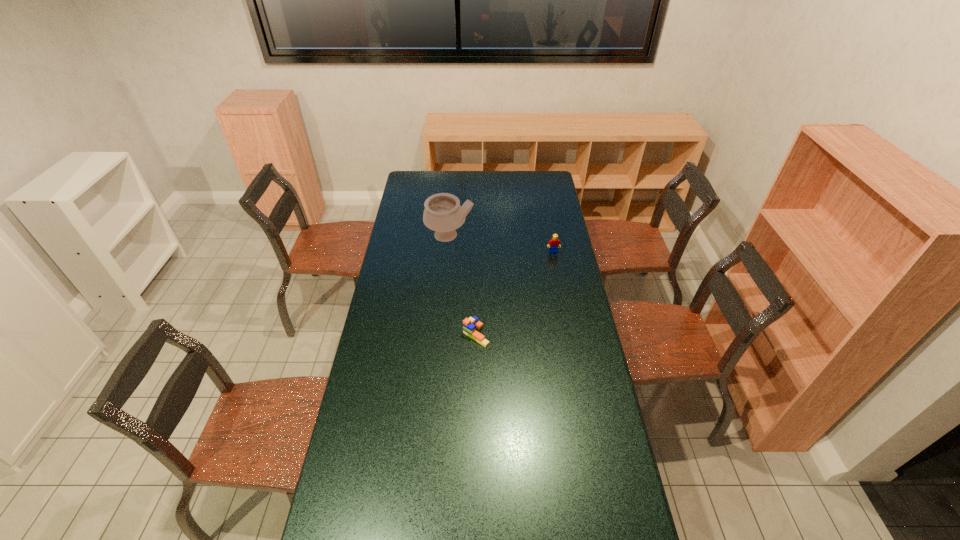
Where is `vacant area at the far edge`? Image resolution: width=960 pixels, height=540 pixels. vacant area at the far edge is located at coordinates [x=456, y=178].

What are the coordinates of `vacant space at the left edge of the desktop` in the screenshot? It's located at (420, 252).

In order to click on vacant area at the right edge of the desktop in this screenshot , I will do (571, 297).

Find the location of a particular element. free space between the farthest object and the rightmost object is located at coordinates (501, 244).

Identify the location of vacant space that's between the nearest object and the tallest object. (463, 285).

Locate an element on the screen. This screenshot has height=540, width=960. vacant region between the left Lego and the pottery is located at coordinates (463, 285).

Locate an element on the screen. The height and width of the screenshot is (540, 960). vacant area that lies between the farther Lego and the farthest object is located at coordinates (501, 244).

I want to click on free space between the second nearest object and the shorter Lego, so click(515, 293).

What are the coordinates of `vacant space in between the pottery and the rightmost object` in the screenshot? It's located at (501, 244).

Where is `vacant point located between the pottery and the nearest object`? Image resolution: width=960 pixels, height=540 pixels. vacant point located between the pottery and the nearest object is located at coordinates (463, 285).